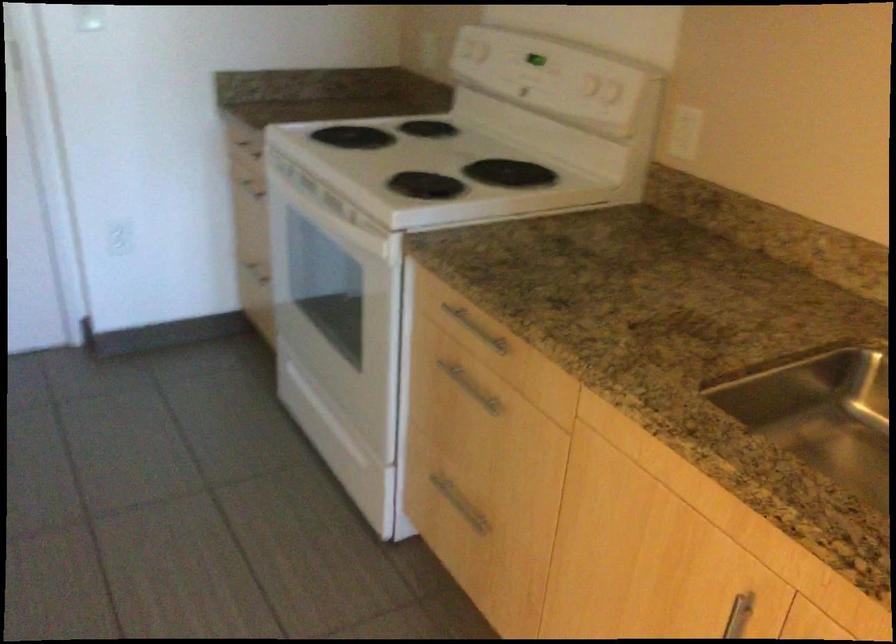
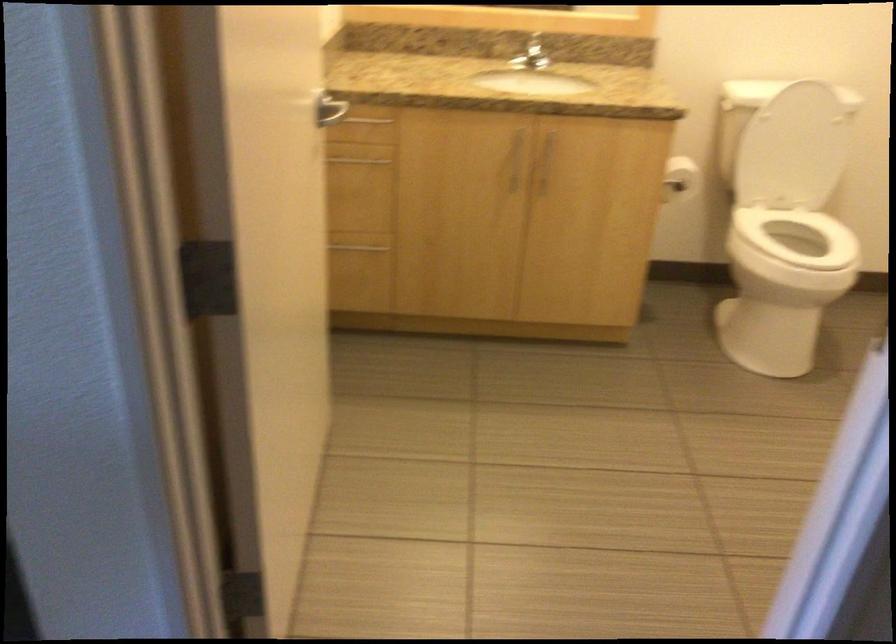
First-person continuous shooting, in which direction is the camera rotating?

The camera's rotation is toward left-down.